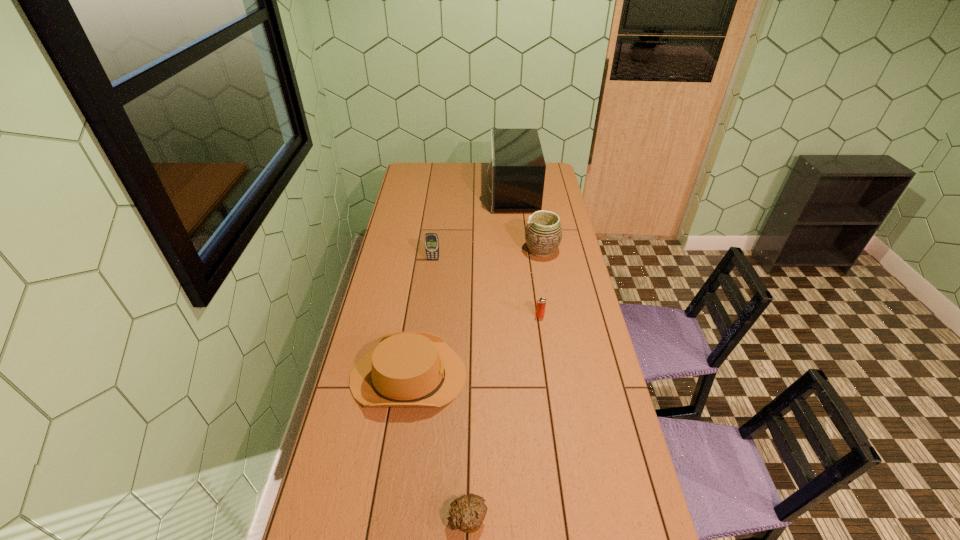
This screenshot has width=960, height=540. Identify the location of free space between the shortest object and the cowboy hat. (439, 447).

This screenshot has height=540, width=960. Find the location of `free space between the fifth farthest object and the fourth farthest object`. free space between the fifth farthest object and the fourth farthest object is located at coordinates (474, 346).

I want to click on empty space between the fifth shortest object and the microwave oven, so click(527, 221).

Locate an element on the screen. This screenshot has width=960, height=540. vacant area that lies between the pottery and the microwave oven is located at coordinates (527, 221).

This screenshot has width=960, height=540. I want to click on the fifth closest object to the shortest object, so click(517, 167).

This screenshot has width=960, height=540. What are the coordinates of `object that is the second nearest to the fourth tallest object` in the screenshot? It's located at (541, 303).

The height and width of the screenshot is (540, 960). I want to click on vacant space that satisfies the following two spatial constraints: 1. on the front-facing side of the cowboy hat; 2. on the back side of the shortest object, so click(x=387, y=518).

Where is `vacant space that satisfies the following two spatial constraints: 1. with the door open on the tallest object; 2. on the screen of the third tallest object`? The height and width of the screenshot is (540, 960). vacant space that satisfies the following two spatial constraints: 1. with the door open on the tallest object; 2. on the screen of the third tallest object is located at coordinates (518, 260).

Identify the location of vacant space that satisfies the following two spatial constraints: 1. with the door open on the tallest object; 2. on the screen of the cellular telephone. The height and width of the screenshot is (540, 960). (518, 260).